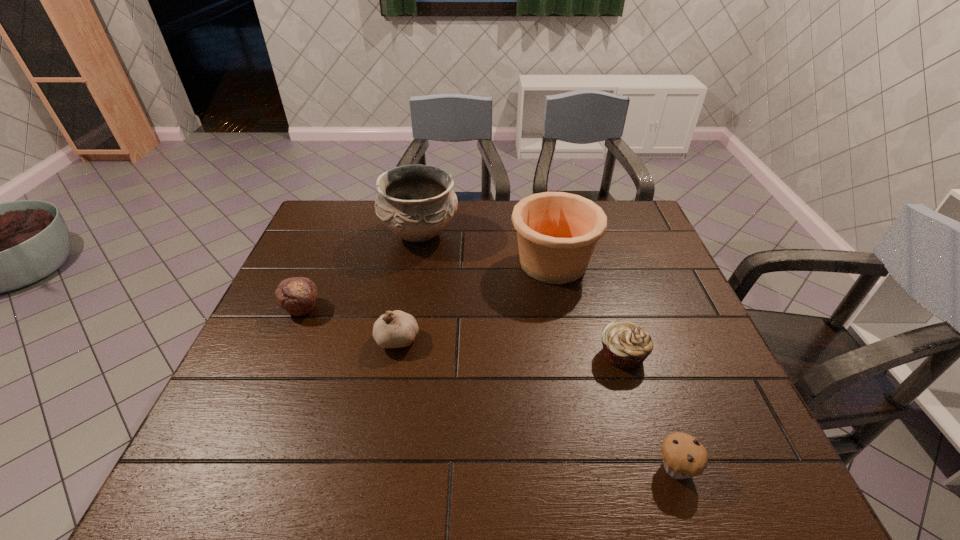
The height and width of the screenshot is (540, 960). Find the location of `the left pottery`. the left pottery is located at coordinates (416, 202).

This screenshot has height=540, width=960. I want to click on the right pottery, so click(x=557, y=232).

You are a GUI agent. You are given a task and a screenshot of the screen. Output one action in this format:
    pyautogui.click(x=<x>, y=<y>)
    Task: Click on the garlic
    The width and height of the screenshot is (960, 540).
    Given the screenshot: What is the action you would take?
    pyautogui.click(x=395, y=329)

This screenshot has width=960, height=540. In order to click on the third farthest object in this screenshot , I will do `click(297, 295)`.

Image resolution: width=960 pixels, height=540 pixels. What are the coordinates of `the farthest muffin` in the screenshot? It's located at (297, 295).

Identify the location of the second farthest muffin. [x=626, y=345].

This screenshot has width=960, height=540. I want to click on the nearest muffin, so click(683, 456).

This screenshot has height=540, width=960. Find the location of `the shortest object`. the shortest object is located at coordinates (683, 456).

Find the location of a particular element. This screenshot has width=960, height=540. blank area located on the right of the left pottery is located at coordinates (551, 233).

Identify the location of free point located on the right of the right pottery. (657, 263).